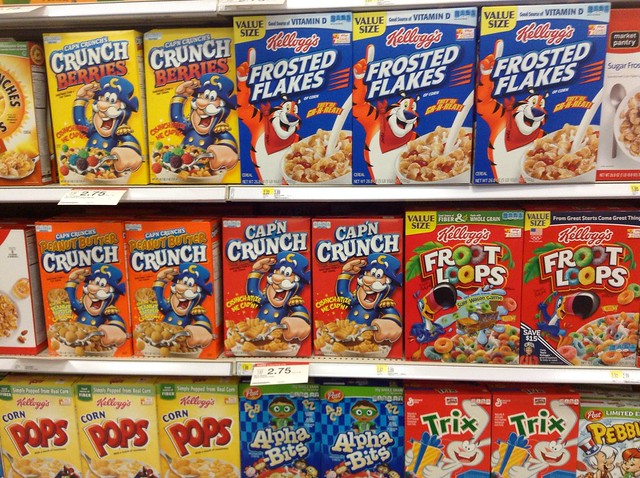
The height and width of the screenshot is (478, 640). What are the coordinates of `cereal boxes completely in frame` in the screenshot? It's located at (86, 90), (196, 106), (287, 109), (380, 108), (483, 95), (72, 271), (166, 271), (252, 266), (355, 263), (449, 272).